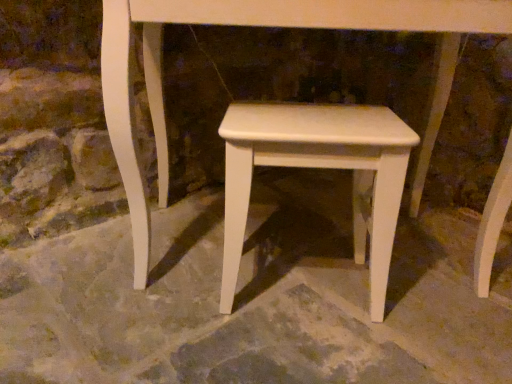
I want to click on free space that is to the left of white matte stool at center, so click(166, 326).